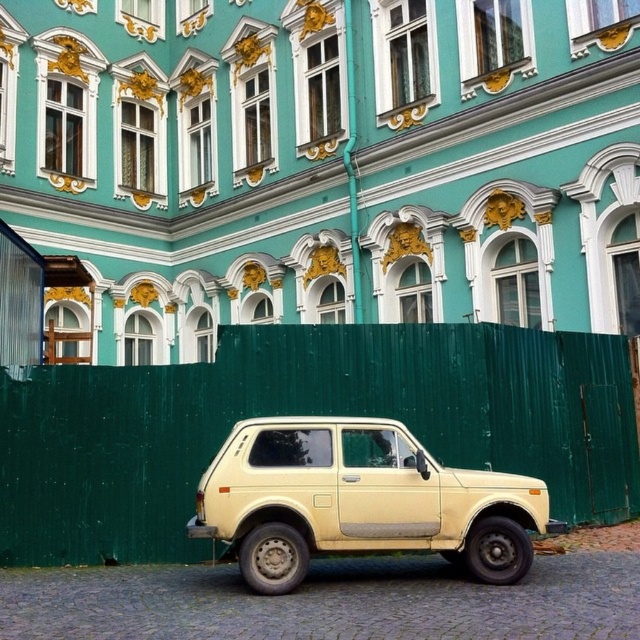
You are a delivery driver who needs to pass through the area shown in the image. You have a truck that is 2 meters tall. Can you safely drive under the green wooden fence at lower center and the beige matte suv at center without hitting the top of your truck?

The green wooden fence at lower center is taller than the beige matte suv at center. Since the fence is taller, if the fence is taller than 2 meters, the truck cannot pass. However, the SUV is shorter than the fence. But since the SUV is parked, the truck would need to go around it. The problem is the fence height. Without knowing the exact height of the fence, we can only say the fence must be under 2m. But the question is about both objects. Since the fence is taller than the SUV, if the SUV is under 2m,

You are a delivery driver approaching the beige matte suv at center parked in front of a grand teal building. There is a green wooden fence at lower center in your path. Can you drive straight ahead without hitting the fence?

The green wooden fence at lower center is located above the beige matte suv at center, so driving straight ahead towards the beige matte suv at center would not lead you into the fence since it is positioned higher up.

From the picture: You are a delivery driver trying to park your beige matte suv at center in a parking spot that is the same width as the green wooden fence at lower center. Can your suv fit inside the parking spot?

The green wooden fence at lower center might be wider than beige matte suv at center, so the suv might fit inside the parking spot if the fence is wider, but there is uncertainty due to the comparison.